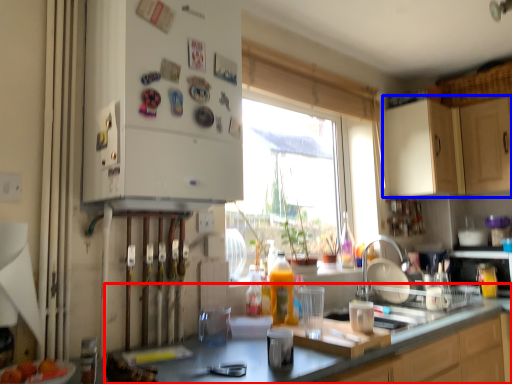
Question: Which of the following is the farthest to the observer, countertop (highlighted by a red box) or cabinetry (highlighted by a blue box)?

Choices:
 (A) countertop
 (B) cabinetry

Answer: (B)